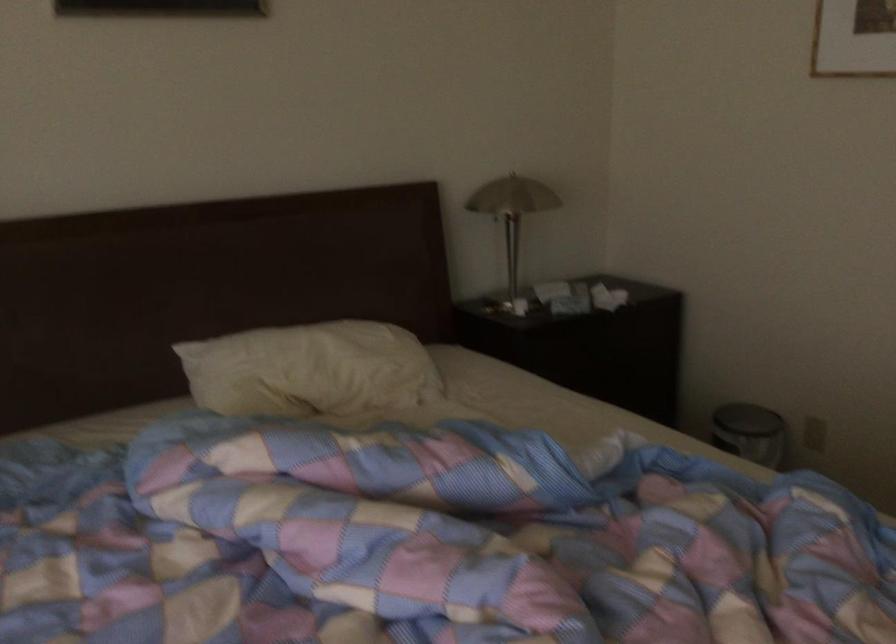
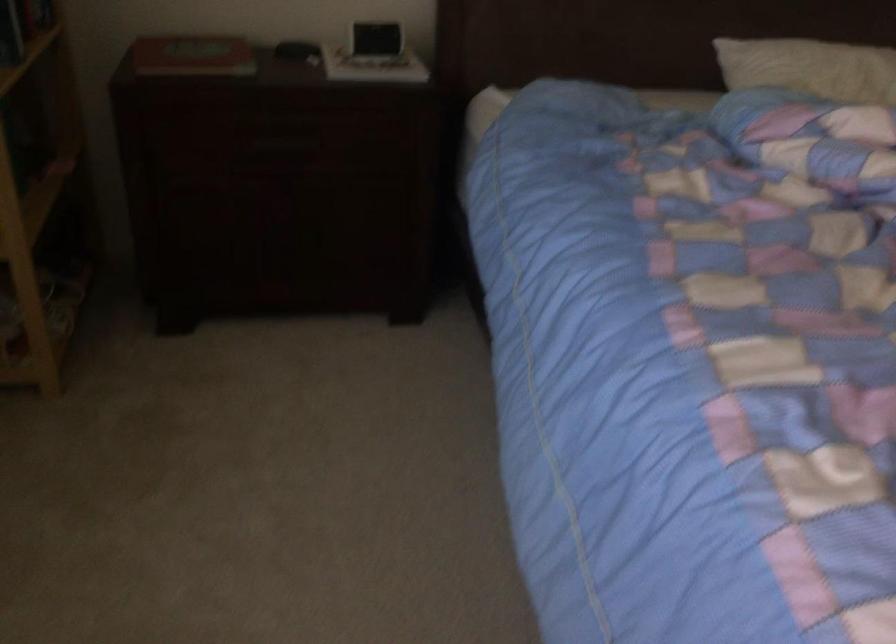
First-person continuous shooting, in which direction is the camera rotating?

The rotation direction of the camera is left-down.